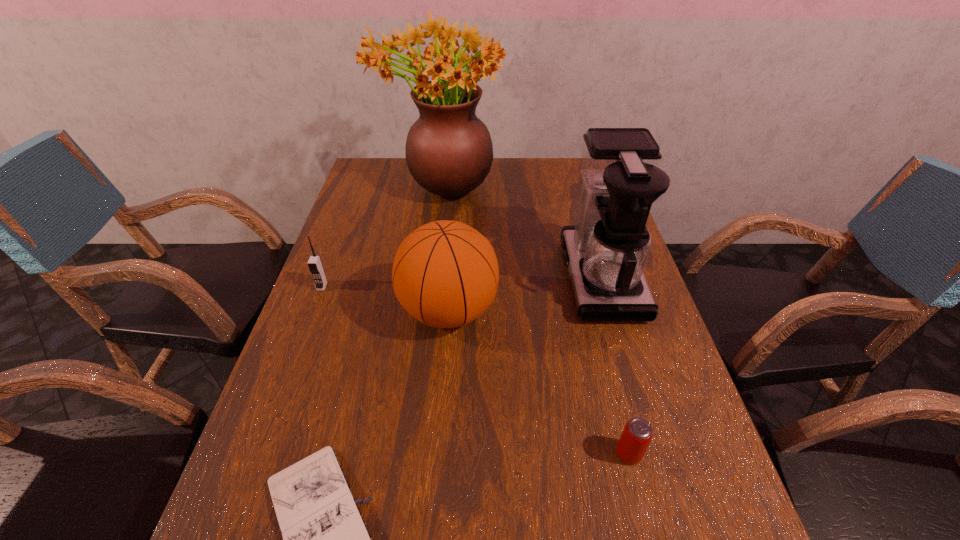
Image resolution: width=960 pixels, height=540 pixels. Identify the location of free space located 0.310m at the front of the coffee maker where the controls are located. (447, 278).

Identify the location of free space located 0.340m on the front of the basketball. The image size is (960, 540). (435, 510).

Where is `blank space located on the front-facing side of the fourth tallest object`? The height and width of the screenshot is (540, 960). blank space located on the front-facing side of the fourth tallest object is located at coordinates (302, 340).

Image resolution: width=960 pixels, height=540 pixels. Identify the location of vacant space located 0.260m on the back of the fifth tallest object. (599, 335).

Locate an element on the screen. object that is at the far edge is located at coordinates (449, 152).

Where is `flower arrangement located at the left edge`? The height and width of the screenshot is (540, 960). flower arrangement located at the left edge is located at coordinates (449, 152).

Where is `cellular telephone at the left edge`? cellular telephone at the left edge is located at coordinates (315, 265).

You are a GUI agent. You are given a task and a screenshot of the screen. Output one action in this format:
    pyautogui.click(x=<x>, y=<y>)
    Task: Click on the coffee maker that is at the right edge
    
    Given the screenshot: What is the action you would take?
    pyautogui.click(x=606, y=252)

The width and height of the screenshot is (960, 540). Find the location of `beer can that is at the right edge`. beer can that is at the right edge is located at coordinates pos(637,434).

The width and height of the screenshot is (960, 540). Identify the location of object located in the far left corner section of the desktop. (449, 152).